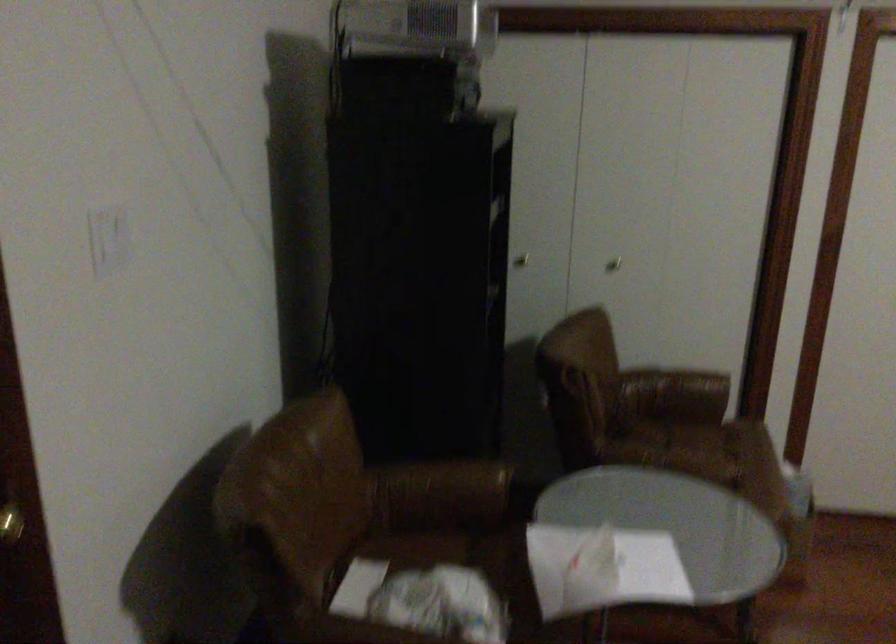
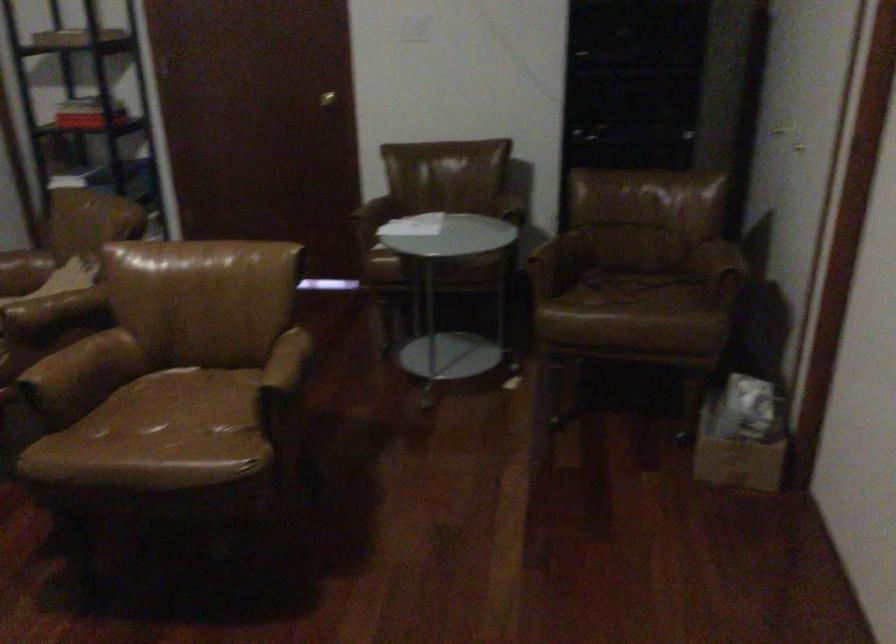
In the second image, find the point that corresponds to point (686, 451) in the first image.

(627, 288)